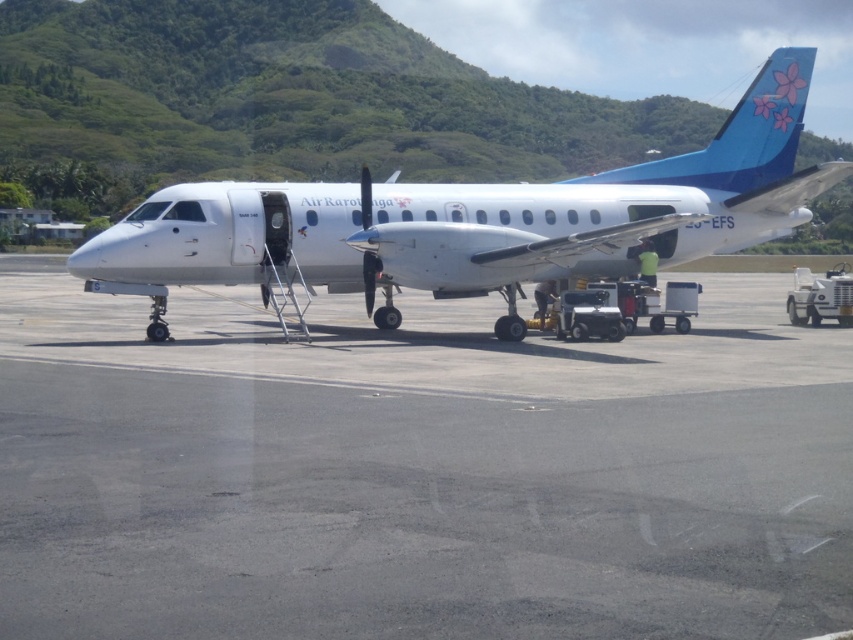
Question: Does gray asphalt tarmac at center appear over white matte airplane at center?

Choices:
 (A) no
 (B) yes

Answer: (A)

Question: Can you confirm if gray asphalt tarmac at center is thinner than white matte airplane at center?

Choices:
 (A) no
 (B) yes

Answer: (A)

Question: Is gray asphalt tarmac at center bigger than white matte airplane at center?

Choices:
 (A) yes
 (B) no

Answer: (B)

Question: Which point is closer to the camera?

Choices:
 (A) gray asphalt tarmac at center
 (B) white matte airplane at center

Answer: (A)